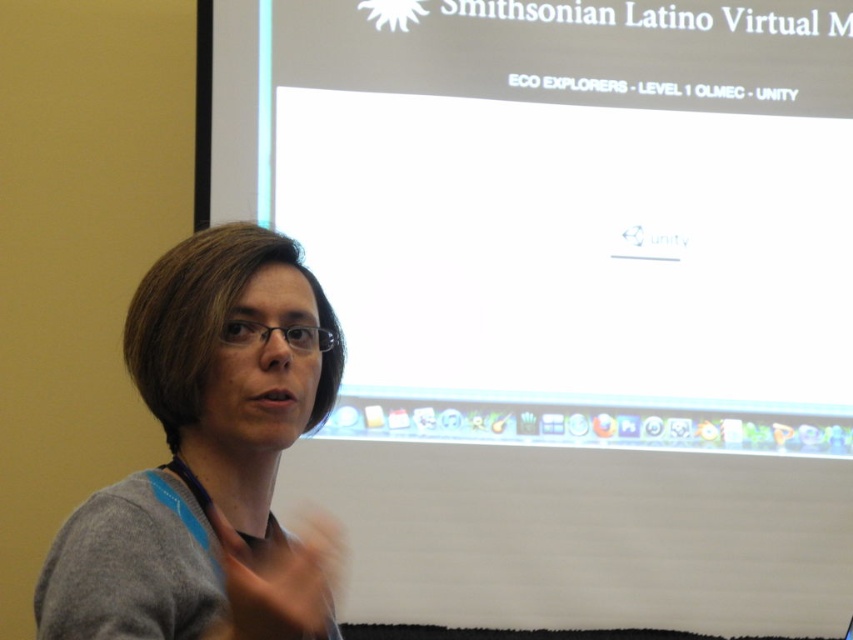
The width and height of the screenshot is (853, 640). What do you see at coordinates (558, 211) in the screenshot?
I see `white glossy projector screen at upper center` at bounding box center [558, 211].

Who is more distant from viewer, (325,230) or (271,456)?

The point (325,230) is behind.

Find the location of `white glossy projector screen at upper center`. white glossy projector screen at upper center is located at coordinates (558, 211).